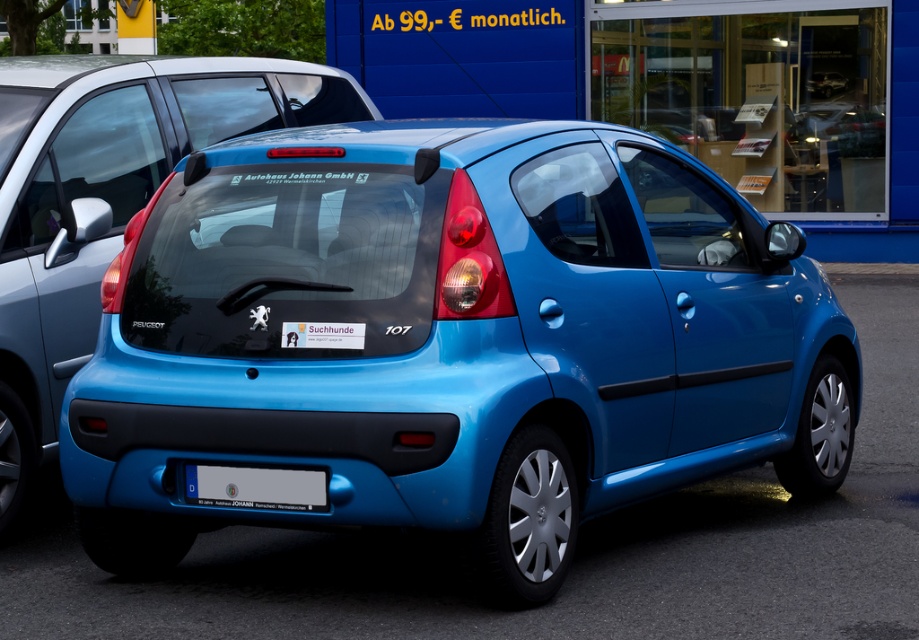
You are a delivery person trying to park your van between two vehicles. You see a matte black minivan at left and a white plastic license plate at center. Which vehicle is taller so you can adjust your parking accordingly?

The matte black minivan at left is much taller than the white plastic license plate at center, so you should adjust your parking to accommodate its height.

You are a delivery person who needs to attach a package to the matte blue car at center. The package is too large to fit on the roof, so you must place it on the white plastic license plate at center. Is this possible given their positions?

The matte blue car at center is above the white plastic license plate at center, so placing the package on the license plate would require attaching it below the car, which is not feasible since the license plate is already at the lowest point. The package cannot be placed there without obstructing the license plate or causing instability.

You are a photographer standing at a certain distance from the matte blue car at center. You want to take a photo that includes the entire car without any cropping. Your camera has a standard lens with a focal length of 50mm. According to photography guidelines, to capture an object of 3.73 meters in length fully in frame, the minimum distance required between the camera and the car should be 5 meters. Can you take the photo from your current position?

The matte blue car at center is 3.73 meters from the camera. Since the required minimum distance is 5 meters to capture the entire car with a 50mm lens, you are too close and cannot take the photo from your current position.